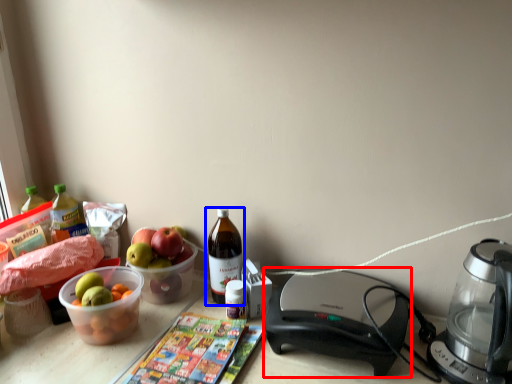
Question: Which point is closer to the camera, appliance (highlighted by a red box) or bottle (highlighted by a blue box)?

Choices:
 (A) appliance
 (B) bottle

Answer: (A)